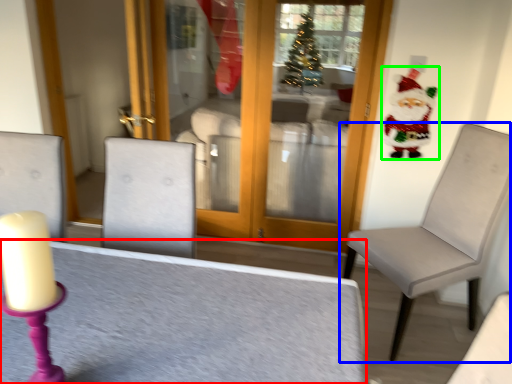
Question: Considering the real-world distances, which object is farthest from table (highlighted by a red box)? chair (highlighted by a blue box) or santa claus (highlighted by a green box)?

Choices:
 (A) chair
 (B) santa claus

Answer: (B)